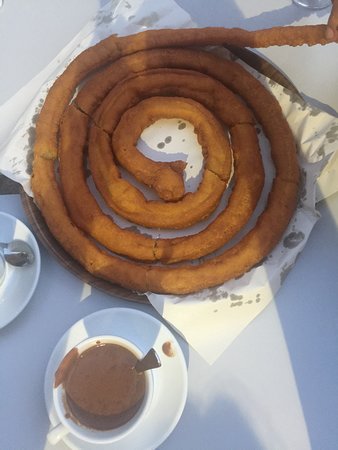
Where is `spoon`? spoon is located at coordinates (140, 358).